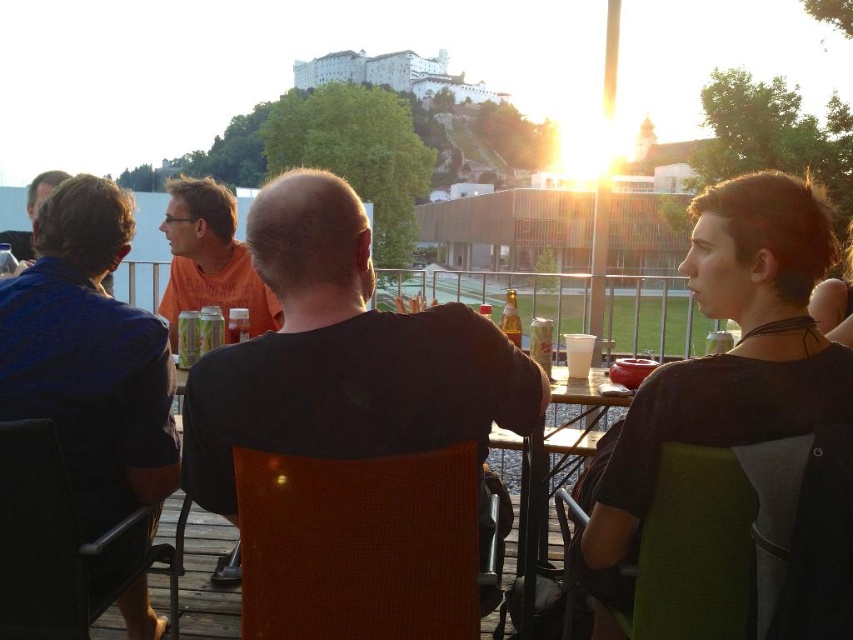
You are standing at the edge of the outdoor dining area and want to place a 2.5 meter long banner between the wooden table at center and the translucent glass beer at table center. Is there enough space between them to fit the banner?

The wooden table at center and the translucent glass beer at table center are 6.48 meters apart, so yes, the banner can be placed between them as the distance is greater than the banner length.

What is the 2D coordinate of the wooden table at center?

The wooden table at center is located at the 2D coordinate point of (x=579, y=412).

You are a photographer trying to capture a group photo of the dark gray shirt at center and the blue cotton shirt at left. Since you want both subjects to appear similarly sized in the photo, which subject should you move closer to the camera?

The dark gray shirt at center is smaller than the blue cotton shirt at left, so you should move the dark gray shirt at center closer to the camera to make them appear similar in size.